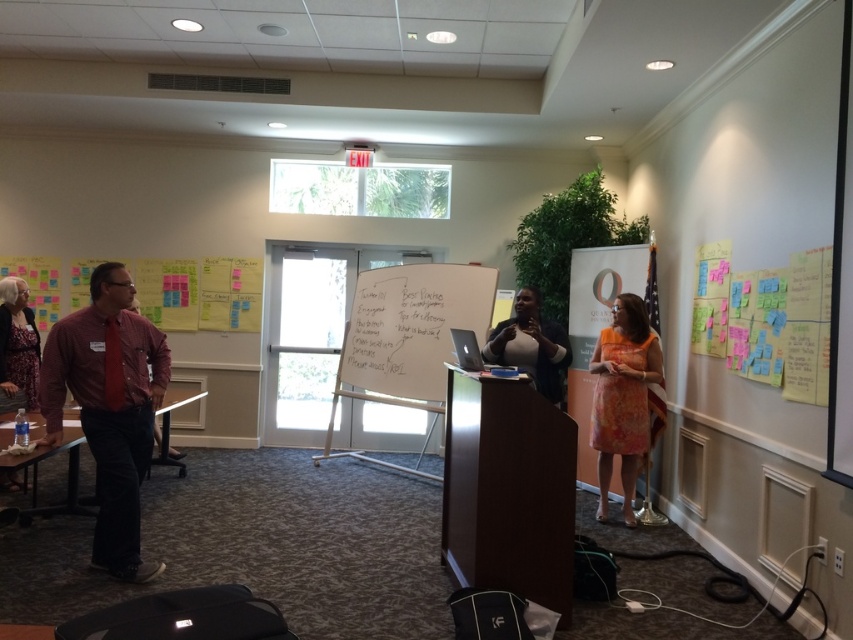
Which is above, plaid shirt at left or dark blue sweater at center?

dark blue sweater at center is higher up.

Who is more distant from viewer, (143,420) or (508,356)?

Point (508,356)

Find the location of a particular element. Image resolution: width=853 pixels, height=640 pixels. plaid shirt at left is located at coordinates (109, 406).

In the scene shown: Can you confirm if plaid shirt at left is thinner than whiteboard at center?

Indeed, plaid shirt at left has a lesser width compared to whiteboard at center.

The height and width of the screenshot is (640, 853). What do you see at coordinates (109, 406) in the screenshot?
I see `plaid shirt at left` at bounding box center [109, 406].

Which is behind, point (83, 385) or point (399, 390)?

The point (399, 390) is behind.

Locate an element on the screen. The image size is (853, 640). plaid shirt at left is located at coordinates (109, 406).

Can you confirm if whiteboard at center is positioned to the right of matte black shirt at left?

Yes, whiteboard at center is to the right of matte black shirt at left.

Is whiteboard at center bigger than matte black shirt at left?

Correct, whiteboard at center is larger in size than matte black shirt at left.

Is point (368, 385) farther from camera compared to point (12, 288)?

Yes, point (368, 385) is farther from viewer.

Locate an element on the screen. whiteboard at center is located at coordinates (410, 330).